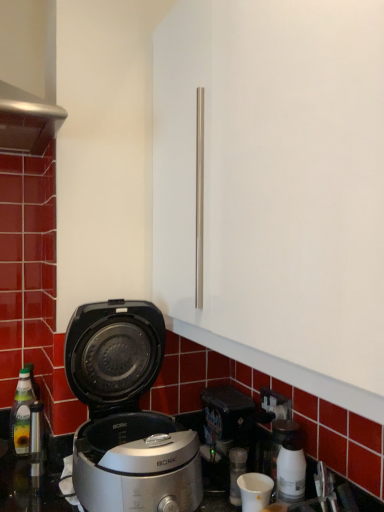
Question: Is translucent glass bottle at left bigger than white glossy coffee machine at lower right?

Choices:
 (A) yes
 (B) no

Answer: (A)

Question: Is translucent glass bottle at left thinner than white glossy coffee machine at lower right?

Choices:
 (A) yes
 (B) no

Answer: (B)

Question: From a real-world perspective, is translucent glass bottle at left positioned over white glossy coffee machine at lower right based on gravity?

Choices:
 (A) yes
 (B) no

Answer: (B)

Question: Is translucent glass bottle at left not close to white glossy coffee machine at lower right?

Choices:
 (A) yes
 (B) no

Answer: (B)

Question: Is translucent glass bottle at left smaller than white glossy coffee machine at lower right?

Choices:
 (A) yes
 (B) no

Answer: (B)

Question: Is white matte cup at lower center wider or thinner than white glossy coffee machine at lower right?

Choices:
 (A) wide
 (B) thin

Answer: (A)

Question: In the image, is white matte cup at lower center positioned in front of or behind white glossy coffee machine at lower right?

Choices:
 (A) front
 (B) behind

Answer: (A)

Question: Looking at the image, does white matte cup at lower center seem bigger or smaller compared to white glossy coffee machine at lower right?

Choices:
 (A) big
 (B) small

Answer: (B)

Question: Considering the positions of point (238, 481) and point (304, 477), is point (238, 481) closer or farther from the camera than point (304, 477)?

Choices:
 (A) farther
 (B) closer

Answer: (A)

Question: Considering their positions, is white glossy coffee machine at lower right located in front of or behind black plastic electric outlet at lower right?

Choices:
 (A) front
 (B) behind

Answer: (A)

Question: Would you say white glossy coffee machine at lower right is inside or outside black plastic electric outlet at lower right?

Choices:
 (A) outside
 (B) inside

Answer: (A)

Question: Visually, is white glossy coffee machine at lower right positioned to the left or to the right of black plastic electric outlet at lower right?

Choices:
 (A) left
 (B) right

Answer: (A)

Question: Looking at their shapes, would you say white glossy coffee machine at lower right is wider or thinner than black plastic electric outlet at lower right?

Choices:
 (A) thin
 (B) wide

Answer: (B)

Question: Considering the relative positions of white glossy coffee machine at lower right and translucent glass bottle at left in the image provided, is white glossy coffee machine at lower right to the left or to the right of translucent glass bottle at left?

Choices:
 (A) left
 (B) right

Answer: (B)

Question: Considering the positions of point (286, 420) and point (11, 433), is point (286, 420) closer or farther from the camera than point (11, 433)?

Choices:
 (A) closer
 (B) farther

Answer: (A)